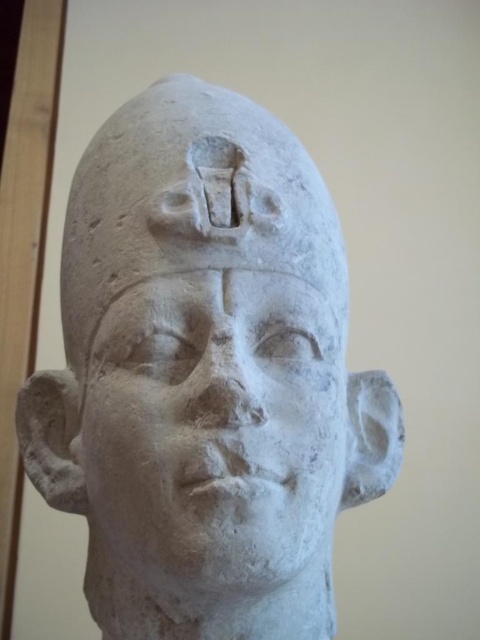
Is white stone head at center to the right of white stone face at center from the viewer's perspective?

In fact, white stone head at center is to the left of white stone face at center.

Is white stone head at center above white stone face at center?

Yes.

Where is `white stone head at center`? The width and height of the screenshot is (480, 640). white stone head at center is located at coordinates (205, 376).